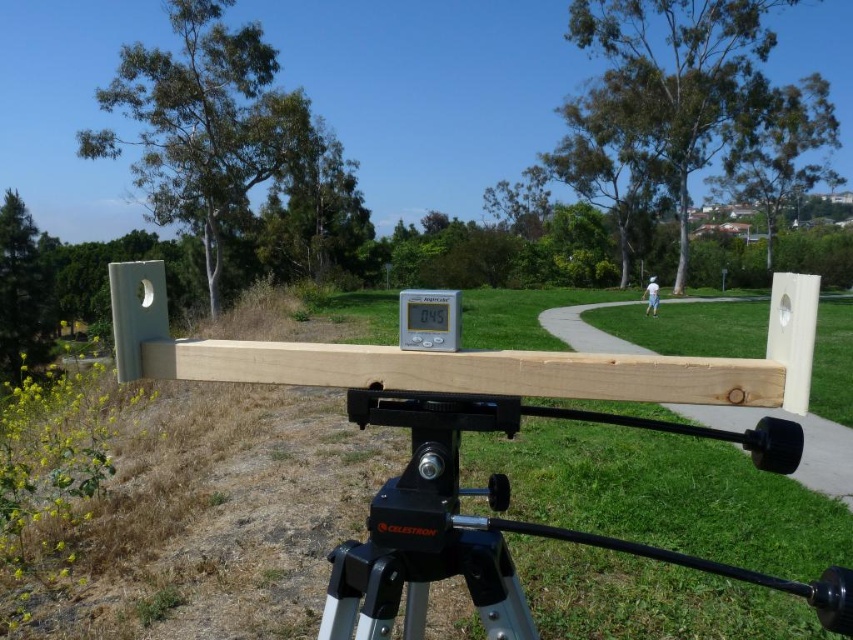
You are setting up an experiment in the field and need to ensure that the black metal tripod at center can support the natural wood plank at center. Given the spatial relationship between them, is the width of the tripod sufficient to hold the plank securely?

The black metal tripod at center has a lesser width compared to natural wood plank at center, so the tripod may not provide sufficient support due to its narrower base. This could compromise stability, especially if the plank is wider than the tripod can accommodate.

Consider the image. You are standing at the center of the image and want to place a new object at the exact center of the black metal tripod at center. What are the coordinates where you should place it?

The coordinates for the exact center of the black metal tripod at center are point (503, 520).